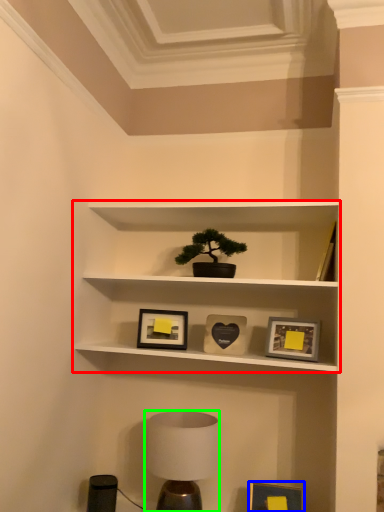
Question: Which object is positioned closest to shelf (highlighted by a red box)? Select from picture frame (highlighted by a blue box) and table lamp (highlighted by a green box).

Choices:
 (A) picture frame
 (B) table lamp

Answer: (B)